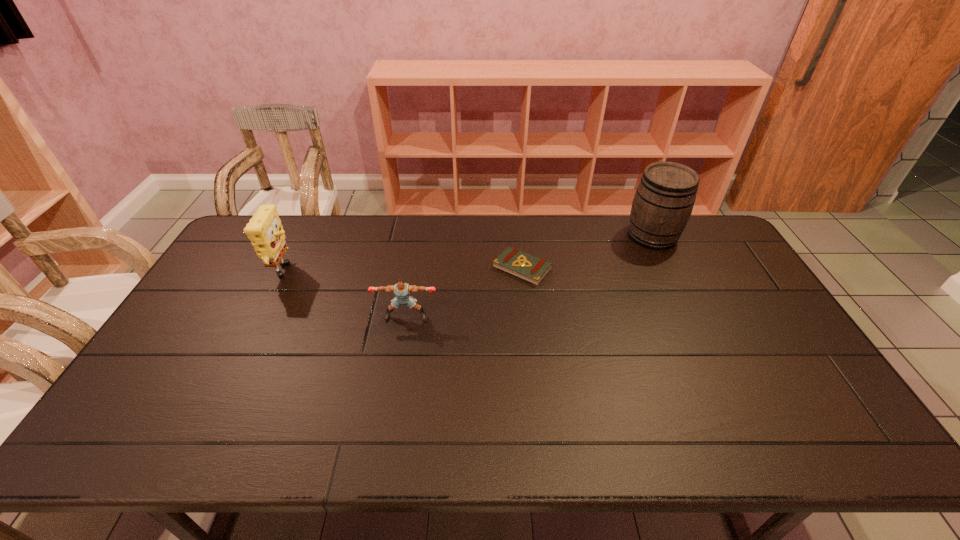
This screenshot has height=540, width=960. I want to click on free region located 0.200m on the back of the second object from right to left, so click(x=516, y=218).

Identify the location of wine bucket that is at the far edge. (665, 196).

I want to click on book positioned at the far edge, so click(x=512, y=261).

This screenshot has width=960, height=540. Find the location of `object that is at the right edge`. object that is at the right edge is located at coordinates (665, 196).

Where is `object located in the far right corner section of the desktop`? object located in the far right corner section of the desktop is located at coordinates (665, 196).

Find the location of `vacant space at the far edge of the desktop`. vacant space at the far edge of the desktop is located at coordinates (533, 238).

You are a GUI agent. You are given a task and a screenshot of the screen. Output one action in this format:
    pyautogui.click(x=<x>, y=<y>)
    Task: Click on the vacant area at the near edge of the desktop
    Image resolution: width=960 pixels, height=540 pixels.
    Given the screenshot: What is the action you would take?
    pyautogui.click(x=459, y=447)

Locate an element on the screen. The image size is (960, 540). free space at the left edge of the desktop is located at coordinates (222, 281).

Find the location of `vacant space at the right edge of the desktop`. vacant space at the right edge of the desktop is located at coordinates (749, 281).

This screenshot has height=540, width=960. In the image, there is a desktop. Find the location of `vacant space at the far left corner`. vacant space at the far left corner is located at coordinates (291, 215).